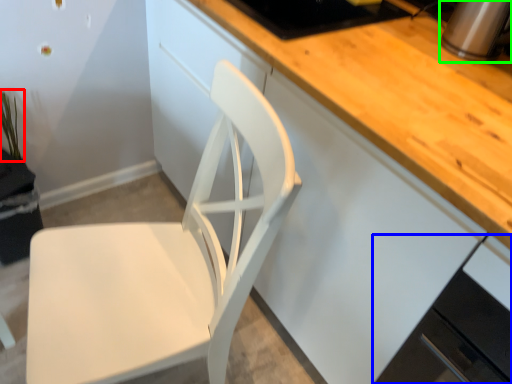
Question: Which is nearer to the plant (highlighted by a red box)? cabinetry (highlighted by a blue box) or appliance (highlighted by a green box).

Choices:
 (A) cabinetry
 (B) appliance

Answer: (B)